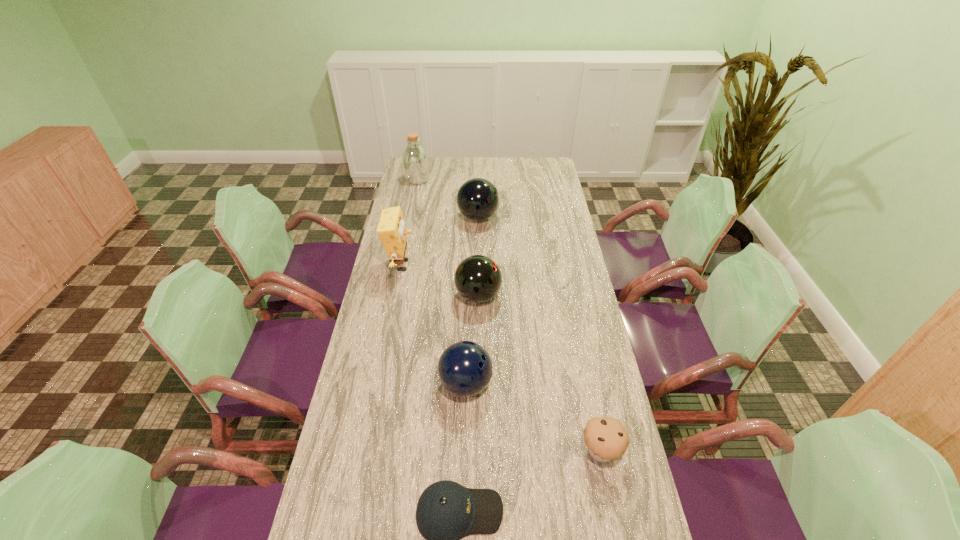
Image resolution: width=960 pixels, height=540 pixels. In order to click on free location located 0.230m on the surface of the second nearest bowling ball near the finger holes in this screenshot , I will do `click(564, 296)`.

Find the location of a particular element. This screenshot has height=540, width=960. vacant region located 0.220m on the surface of the nearest bowling ball near the finger holes is located at coordinates (564, 384).

The image size is (960, 540). What are the coordinates of `free space located 0.260m on the left of the second shortest object` in the screenshot? It's located at (484, 451).

Find the location of `object at the far edge`. object at the far edge is located at coordinates 415,159.

Image resolution: width=960 pixels, height=540 pixels. What are the coordinates of `bottle present at the left edge` in the screenshot? It's located at (415, 159).

Where is `sponge present at the left edge`? The width and height of the screenshot is (960, 540). sponge present at the left edge is located at coordinates pyautogui.click(x=391, y=230).

Find the location of a particular element. The width and height of the screenshot is (960, 540). object positioned at the right edge is located at coordinates (606, 438).

Where is `object located at the far left corner`? The image size is (960, 540). object located at the far left corner is located at coordinates (415, 159).

Image resolution: width=960 pixels, height=540 pixels. Identify the location of vacant space at the far edge. (505, 163).

Where is `vacant space at the left edge`? vacant space at the left edge is located at coordinates 374,325.